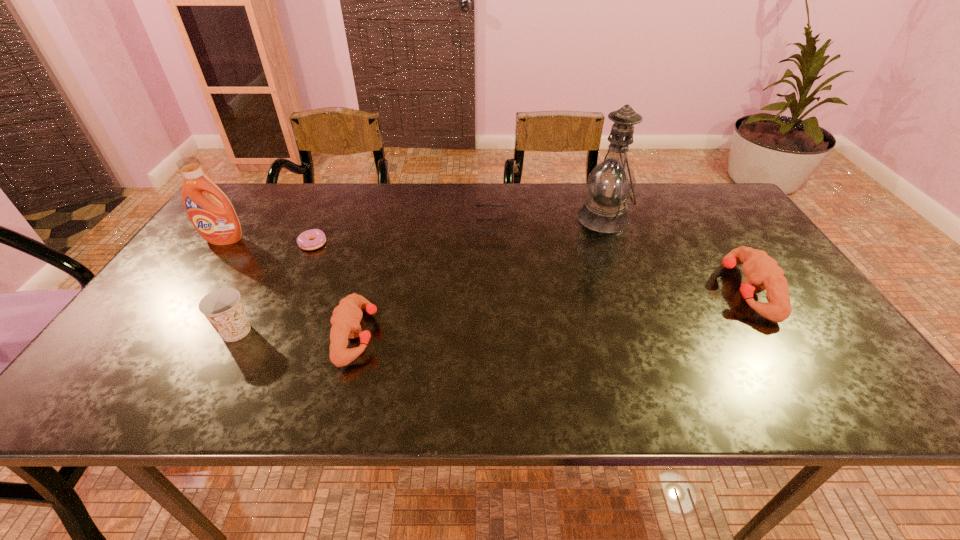
Please point a spot to place another puncher for symmetrical spacing. Please provide its 2D coordinates. Your answer should be formatted as a tuple, i.e. [(x, y)], where the tuple contains the x and y coordinates of a point satisfying the conditions above.

[(562, 312)]